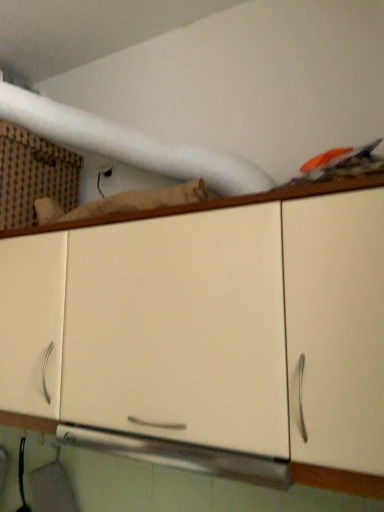
This screenshot has width=384, height=512. Describe the element at coordinates (34, 175) in the screenshot. I see `patterned cardboard box at upper left` at that location.

Where is `patterned cardboard box at upper left`? The height and width of the screenshot is (512, 384). patterned cardboard box at upper left is located at coordinates (34, 175).

What are the coordinates of `patterned cardboard box at upper left` in the screenshot? It's located at (34, 175).